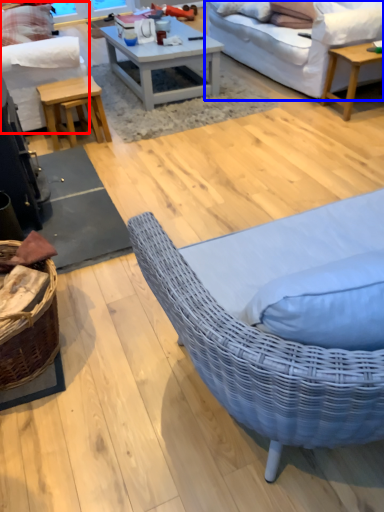
Question: Which object appears farthest to the camera in this image, studio couch (highlighted by a red box) or studio couch (highlighted by a blue box)?

Choices:
 (A) studio couch
 (B) studio couch

Answer: (B)